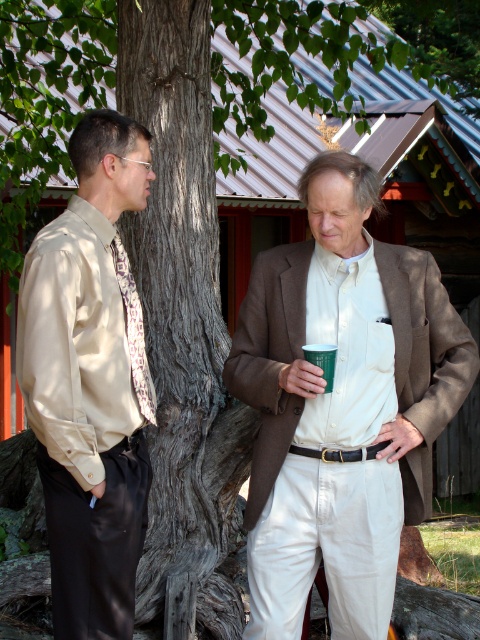
Is brown woolen blazer at center positioned at the back of matte beige shirt at left?

Yes, it is.

Is the position of brown woolen blazer at center less distant than that of matte beige shirt at left?

No, brown woolen blazer at center is further to the viewer.

This screenshot has width=480, height=640. Describe the element at coordinates (342, 404) in the screenshot. I see `brown woolen blazer at center` at that location.

The height and width of the screenshot is (640, 480). I want to click on brown woolen blazer at center, so click(342, 404).

Is dark brown textured bark at center above green paper cup at center?

Yes.

Between point (151, 211) and point (330, 364), which one is positioned in front?

Point (330, 364) is more forward.

Image resolution: width=480 pixels, height=640 pixels. Identify the location of dark brown textured bark at center. (181, 312).

Does point (456, 337) come in front of point (207, 420)?

Yes, it is in front of point (207, 420).

Which is below, brown woolen blazer at center or dark brown textured bark at center?

brown woolen blazer at center

The width and height of the screenshot is (480, 640). What are the coordinates of `brown woolen blazer at center` in the screenshot? It's located at (342, 404).